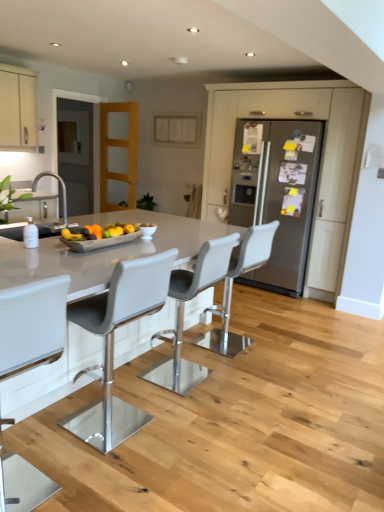
Locate an element on the screen. free area behind white leather bar stool at center, arranged as the 4th chair when viewed from the front is located at coordinates (238, 325).